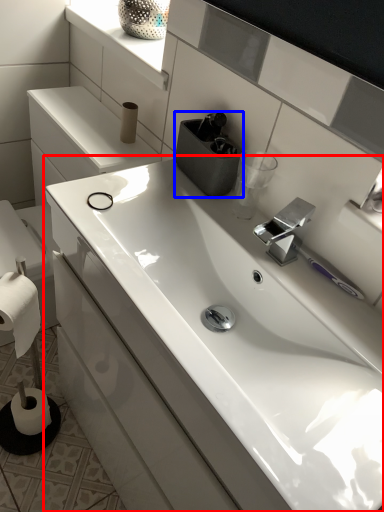
Question: Which point is further to the camera, sink (highlighted by a red box) or appliance (highlighted by a blue box)?

Choices:
 (A) sink
 (B) appliance

Answer: (B)